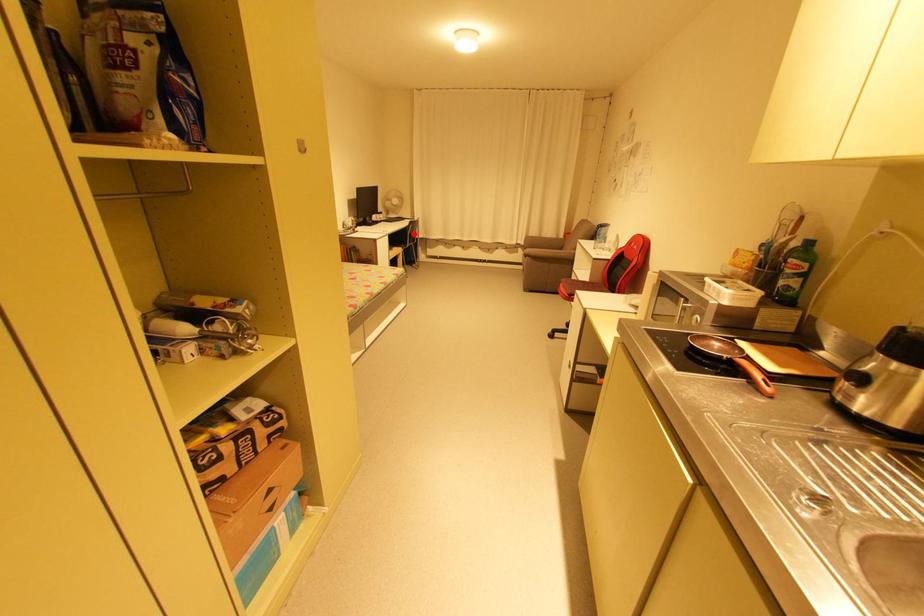
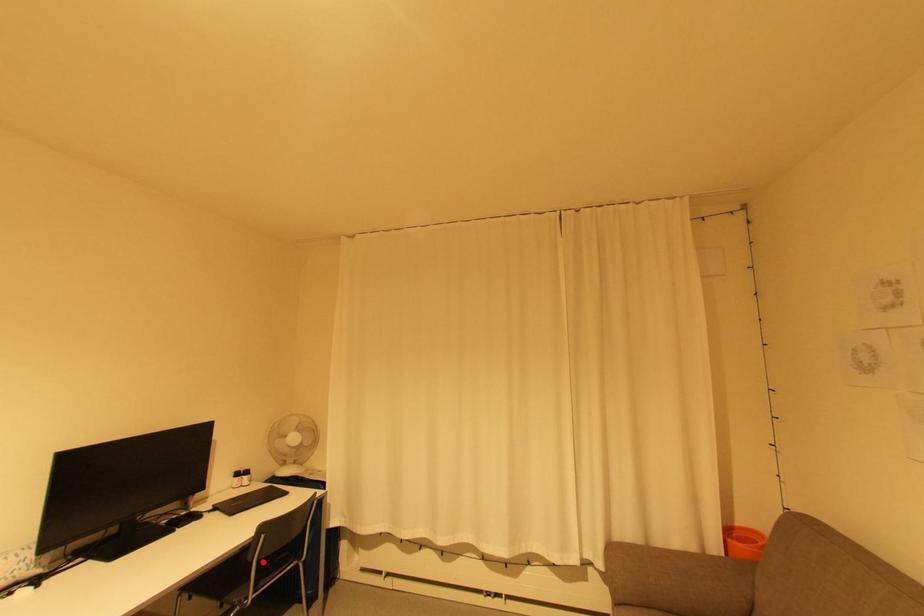
I am providing you with two images of the same scene from different viewpoints. A red point is marked on the first image and another point is marked on the second image. Is the marked point in image1 the same physical position as the marked point in image2?

Yes